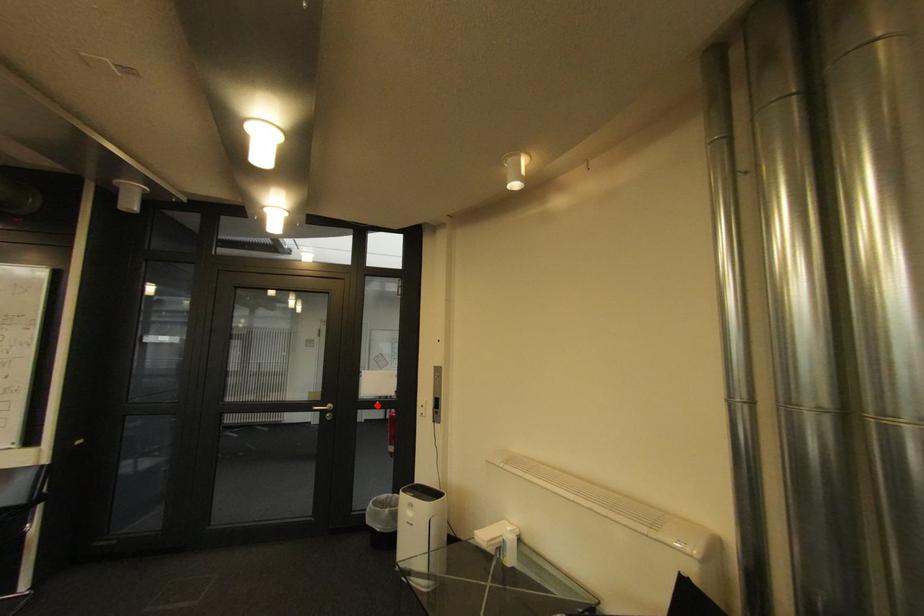
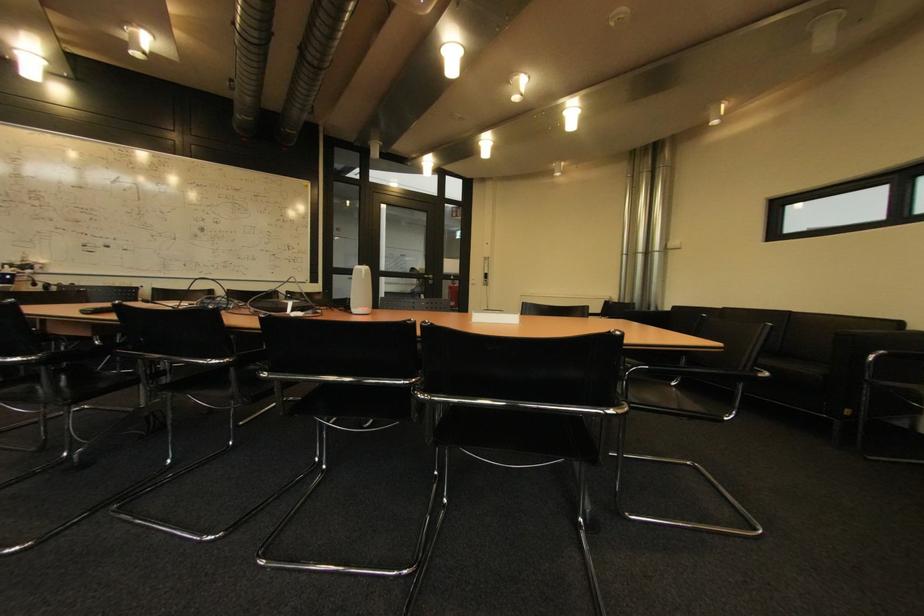
Where in the second image is the point corresponding to the highlighted location from the first image?

(456, 278)